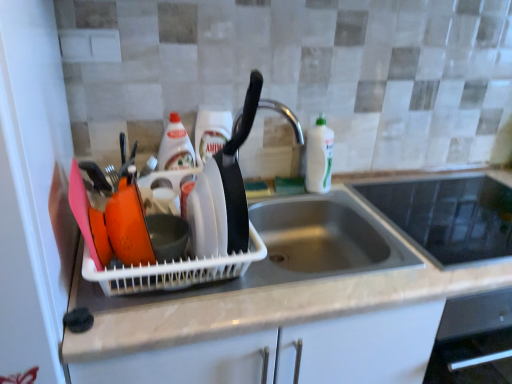
Locate an element on the screen. free location to the right of white glossy bottle at sink right, the third bottle positioned from the left is located at coordinates coord(366,187).